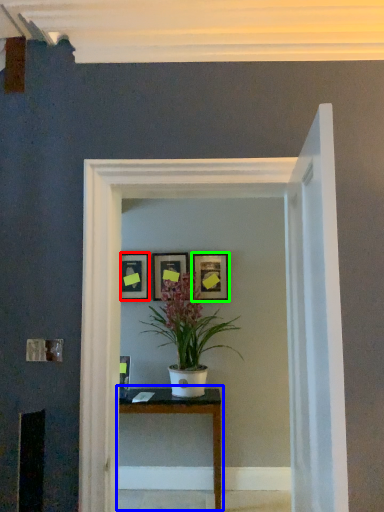
Question: Which object is the farthest from picture frame (highlighted by a red box)? Choose among these: table (highlighted by a blue box) or picture frame (highlighted by a green box).

Choices:
 (A) table
 (B) picture frame

Answer: (A)